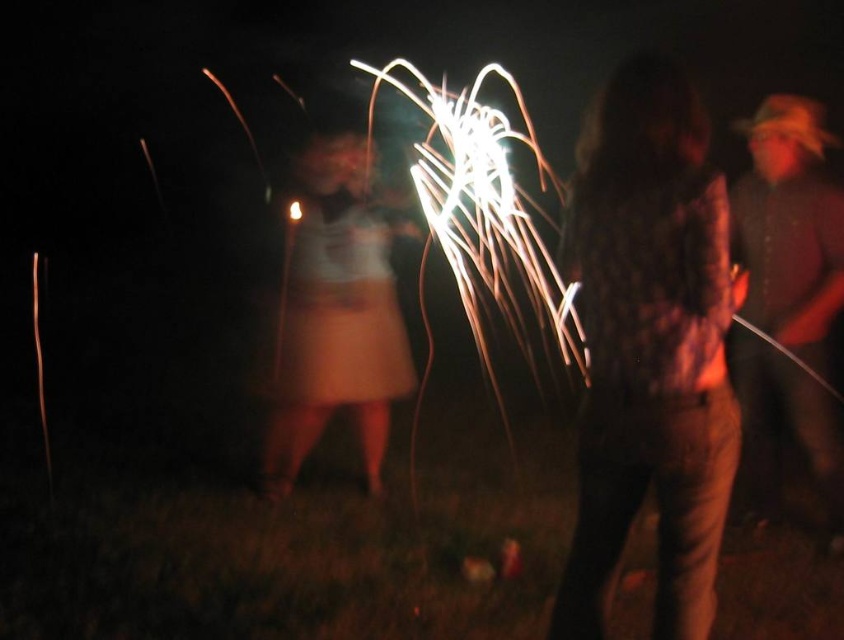
You are at a nighttime gathering where people are using sparklers. You see a fluffy brown coat at center and a white matte dress at center. Which one is closer to you?

The fluffy brown coat at center is closer to you because it is in front of the white matte dress at center.

You are attending a nighttime event and want to take a photo of the fluffy brown coat at center and the white matte dress at center. Which one appears shorter in the image?

The fluffy brown coat at center is shorter than the white matte dress at center.

You are organizing a photo shoot and need to place two props, a fluffy brown coat at center and a brown textured shirt at right, in a way that they are exactly 5 feet apart. Based on the scene described, is the current placement of these items meeting the requirement?

The fluffy brown coat at center and brown textured shirt at right are 5.12 feet apart, which is slightly more than 5 feet. Therefore, the current placement exceeds the required distance by 0.12 feet.